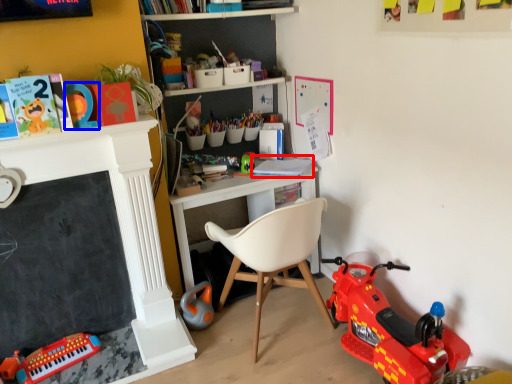
Question: Which object appears closest to the camera in this image, book (highlighted by a red box) or toy (highlighted by a blue box)?

Choices:
 (A) book
 (B) toy

Answer: (B)